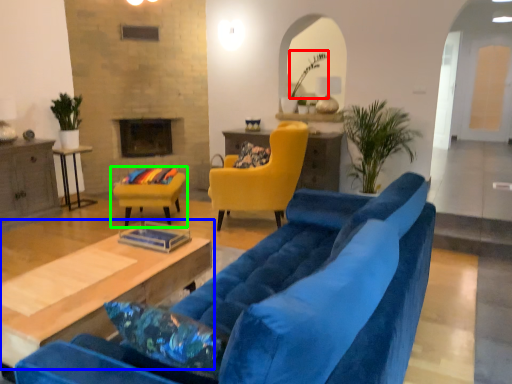
Question: Which object is the closest to the plant (highlighted by a red box)? Choose among these: table (highlighted by a blue box) or chair (highlighted by a green box).

Choices:
 (A) table
 (B) chair

Answer: (B)